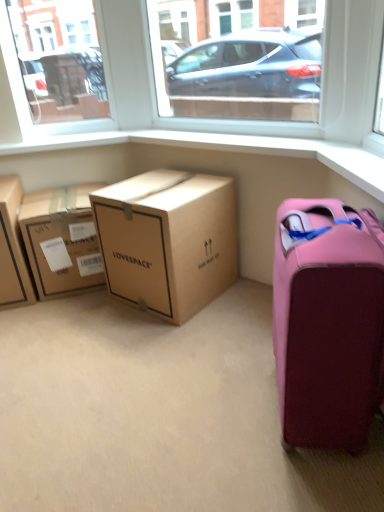
Question: In the image, is transparent glass window at upper center, which ranks as the 2th window screen in left-to-right order, positioned in front of or behind transparent glass window at upper left, the 1th window screen positioned from the left?

Choices:
 (A) behind
 (B) front

Answer: (B)

Question: From the image's perspective, is transparent glass window at upper center, which ranks as the 2th window screen in left-to-right order, above or below transparent glass window at upper left, the 1th window screen positioned from the left?

Choices:
 (A) above
 (B) below

Answer: (B)

Question: Which object is the closest to the matte brown cardboard box at left, arranged as the 1th box when viewed from the left?

Choices:
 (A) pink matte suitcase at lower right
 (B) brown cardboard box at center, which is the second box in left-to-right order
 (C) brown cardboard box at center, the first box positioned from the right
 (D) transparent glass window at upper center, which ranks as the 2th window screen in left-to-right order
 (E) transparent glass window at upper left, which is counted as the second window screen, starting from the right

Answer: (B)

Question: Based on their relative distances, which object is farther from the transparent glass window at upper center, which ranks as the 2th window screen in left-to-right order?

Choices:
 (A) brown cardboard box at center, which appears as the second box when viewed from the right
 (B) pink matte suitcase at lower right
 (C) brown cardboard box at center, which is the third box from left to right
 (D) matte brown cardboard box at left, the third box from the right
 (E) transparent glass window at upper left, the 1th window screen positioned from the left

Answer: (D)